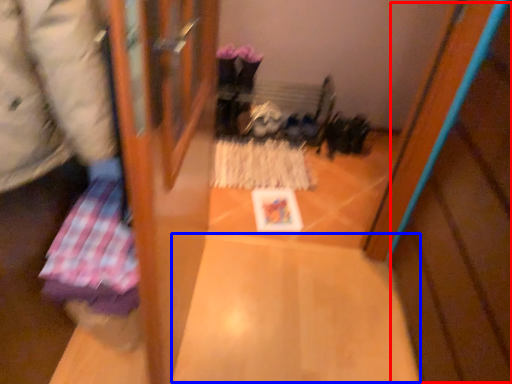
Question: Which object appears farthest to the camera in this image, wood (highlighted by a red box) or wide (highlighted by a blue box)?

Choices:
 (A) wood
 (B) wide

Answer: (B)